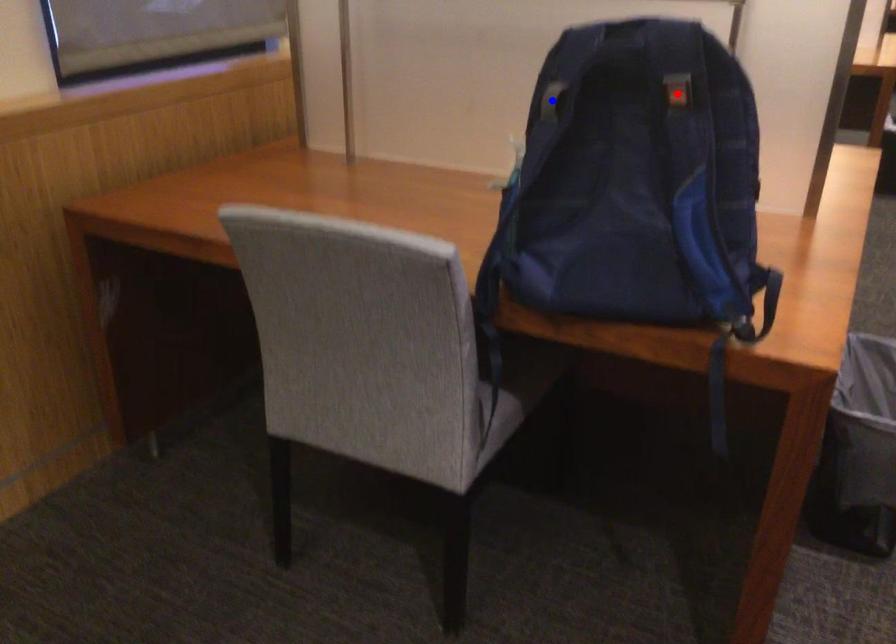
Question: Two points are marked on the image. Which point is closer to the camera?

Choices:
 (A) Blue point is closer.
 (B) Red point is closer.

Answer: (B)